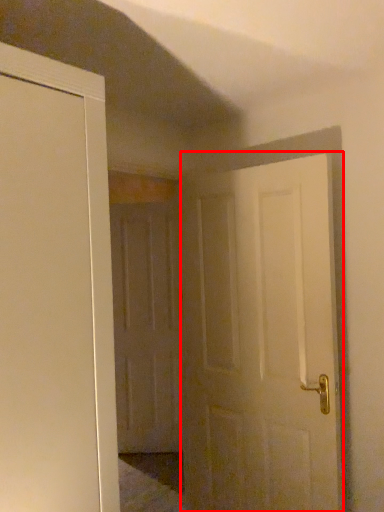
Question: From the image's perspective, what is the correct spatial relationship of door (annotated by the red box) in relation to door?

Choices:
 (A) below
 (B) above

Answer: (B)